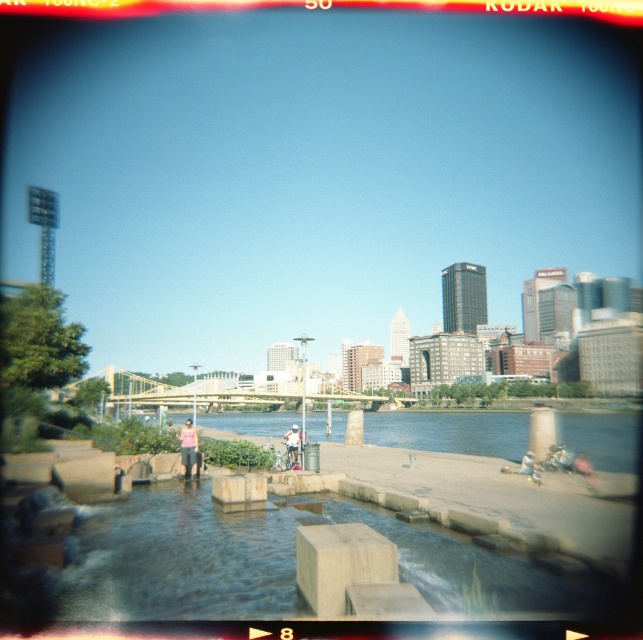
Question: Does smooth concrete river at center lie behind white cotton shirt at center?

Choices:
 (A) no
 (B) yes

Answer: (A)

Question: Observing the image, what is the correct spatial positioning of smooth concrete river at center in reference to pink fabric person at center?

Choices:
 (A) above
 (B) below

Answer: (B)

Question: Which of the following is the closest to the observer?

Choices:
 (A) smooth concrete river at center
 (B) white cotton shirt at center

Answer: (A)

Question: Does clear water at center appear on the right side of white cotton shirt at center?

Choices:
 (A) yes
 (B) no

Answer: (A)

Question: Considering the real-world distances, which object is farthest from the pink fabric person at center?

Choices:
 (A) white cotton shirt at center
 (B) smooth concrete river at center
 (C) clear water at center

Answer: (C)

Question: Which point is farther to the camera?

Choices:
 (A) clear water at center
 (B) smooth concrete river at center

Answer: (A)